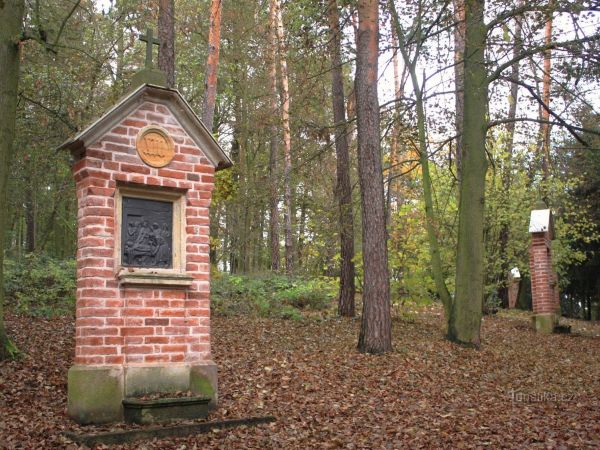
Locate an element on the screen. This screenshot has height=450, width=600. religious engraved picture is located at coordinates (156, 246), (141, 237).